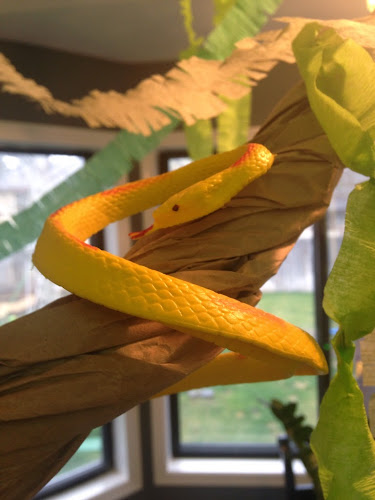
Find the location of a particular element. scales is located at coordinates (168, 306), (131, 289), (132, 283), (221, 319), (197, 320).